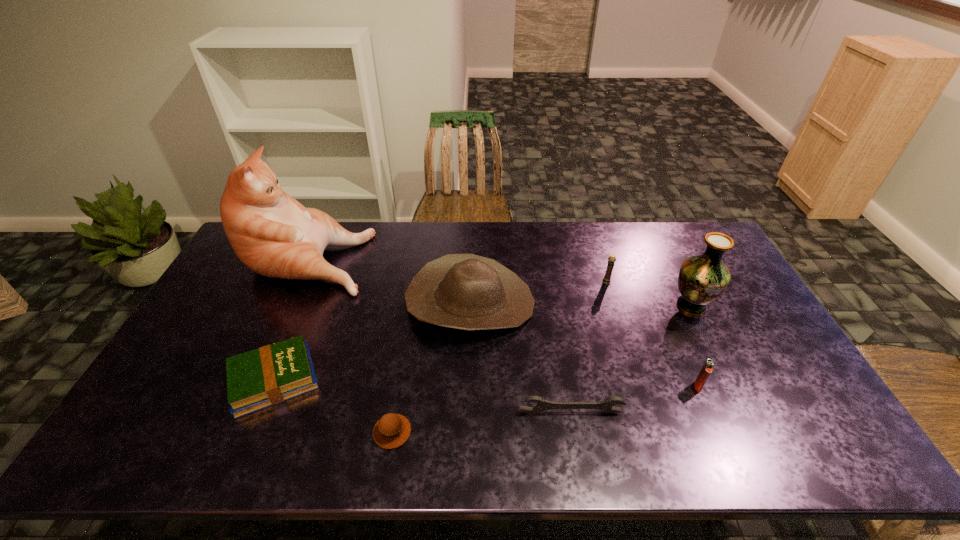
Where is `muffin`? muffin is located at coordinates (392, 430).

At what (x,y) coordinates should I click in order to perform the action: click on vacant space located on the face of the cat. Please return your answer as a coordinate pair (x, y). Image resolution: width=960 pixels, height=540 pixels. Looking at the image, I should click on (394, 256).

Identify the location of free point located on the back of the rightmost object. This screenshot has height=540, width=960. (656, 234).

Where is `vacant space located on the left of the third tallest object`? vacant space located on the left of the third tallest object is located at coordinates (288, 303).

I want to click on free region located on the back of the candle holder, so click(592, 235).

Identify the location of free space located on the back of the fourth shortest object. This screenshot has width=960, height=540. (652, 280).

The height and width of the screenshot is (540, 960). In order to click on free point located on the open ends of the wrench in this screenshot , I will do pos(580,461).

Where is `free space located 0.240m on the right of the book`? free space located 0.240m on the right of the book is located at coordinates (412, 379).

Locate an element on the screen. vacant point located 0.370m on the left of the muffin is located at coordinates (220, 432).

Where is `object that is positioned at the far edge`? object that is positioned at the far edge is located at coordinates (274, 235).